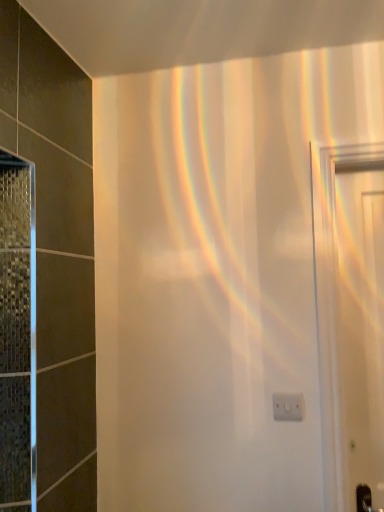
Image resolution: width=384 pixels, height=512 pixels. Identify the location of white plastic/light switch at lower center. (288, 407).

Describe the element at coordinates (288, 407) in the screenshot. The image size is (384, 512). I see `white plastic/light switch at lower center` at that location.

Consider the image. Measure the distance between white plastic/light switch at lower center and camera.

The depth of white plastic/light switch at lower center is 4.35 feet.

Image resolution: width=384 pixels, height=512 pixels. In order to click on white plastic/light switch at lower center in this screenshot , I will do `click(288, 407)`.